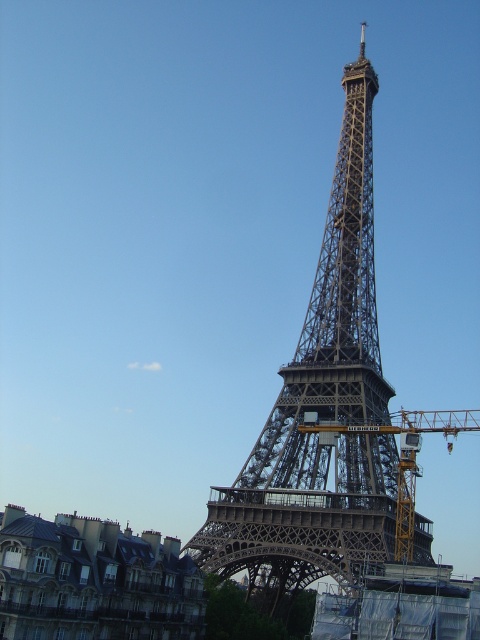
You are a tourist visiting Paris and want to take a photo of both the metallic lattice tower at center and the yellow metallic crane at center. Which object should you stand closer to in order to capture both in your camera frame?

Since the metallic lattice tower at center is taller than the yellow metallic crane at center, you should stand closer to the metallic lattice tower at center to ensure both objects fit within your camera frame.

You are a tourist visiting Paris and want to take a photo of both the metallic lattice tower at center and the yellow metallic crane at center in the same frame. Considering their sizes, which object should you position closer to the camera to ensure both are visible clearly in your photo?

Since the metallic lattice tower at center is larger than the yellow metallic crane at center, you should position the yellow metallic crane at center closer to the camera to ensure both objects are visible clearly in the photo.

You are an architect planning to install a new lighting system on the metallic lattice tower at center and the yellow metallic crane at center. The crane requires a wider base for stability. Based on the scene, which object would require a larger base for its lighting system?

The yellow metallic crane at center would require a larger base for its lighting system because its width is greater than the metallic lattice tower at center.